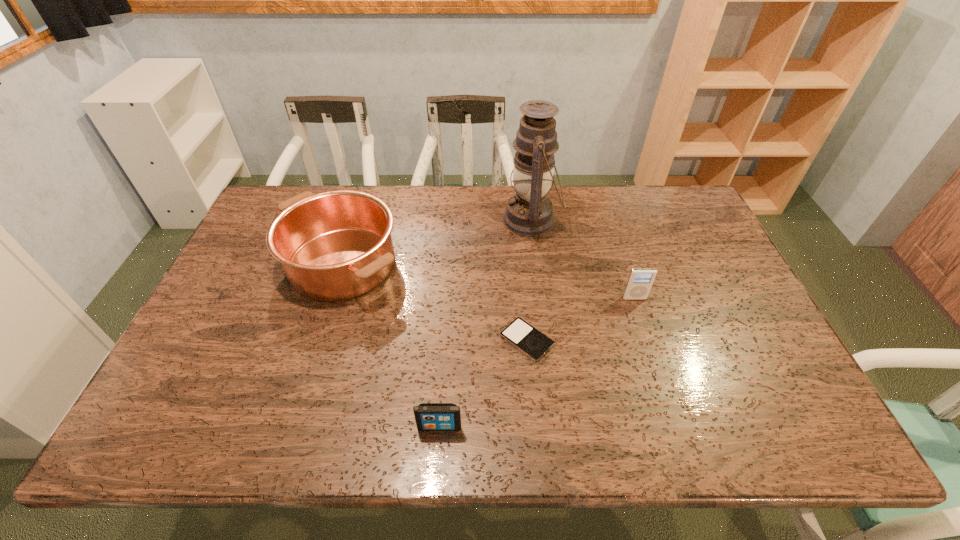
Locate an element on the screen. oil lamp is located at coordinates (529, 212).

I want to click on the fourth shortest object, so click(x=336, y=245).

What are the coordinates of `saucepan` in the screenshot? It's located at (336, 245).

Locate an element on the screen. This screenshot has width=960, height=540. the third shortest object is located at coordinates (640, 280).

In order to click on the rightmost iPod in this screenshot , I will do `click(640, 280)`.

Identify the location of the leftmost iPod. The width and height of the screenshot is (960, 540). [x=429, y=416].

You are a GUI agent. You are given a task and a screenshot of the screen. Output one action in this format:
    pyautogui.click(x=<x>, y=<y>)
    Task: Click on the fourth object from right to left
    
    Given the screenshot: What is the action you would take?
    [x=429, y=416]

Identify the location of the shortest iPod. (529, 340).

What are the coordinates of `the second farthest iPod` in the screenshot? It's located at (529, 340).

You are a GUI agent. You are given a task and a screenshot of the screen. Output one action in this format:
    pyautogui.click(x=<x>, y=<y>)
    Task: Click on the free point located on the left of the tallest object
    This screenshot has height=540, width=960.
    Given the screenshot: What is the action you would take?
    pyautogui.click(x=455, y=219)